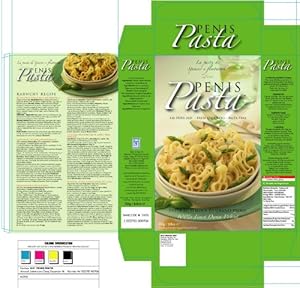
Where is `bowls`? bowls is located at coordinates pyautogui.click(x=230, y=198), pyautogui.click(x=233, y=188), pyautogui.click(x=105, y=80).